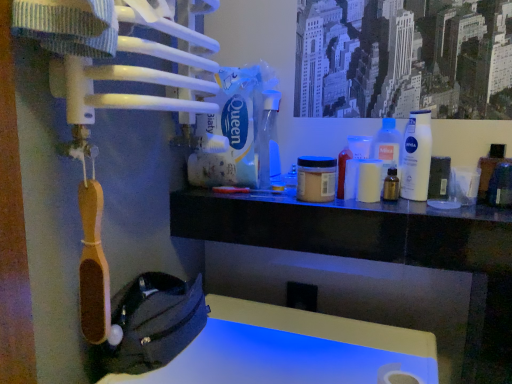
Question: From a real-world perspective, is white plastic bottle at upper right, placed as the 1th bottle when sorted from right to left, above or below translucent amber bottle at center, which is the second bottle in left-to-right order?

Choices:
 (A) below
 (B) above

Answer: (B)

Question: Based on their sizes in the image, would you say white plastic bottle at upper right, placed as the 1th bottle when sorted from right to left, is bigger or smaller than translucent amber bottle at center, which is the second bottle in left-to-right order?

Choices:
 (A) small
 (B) big

Answer: (B)

Question: Estimate the real-world distances between objects in this image. Which object is farther from the velvet black pouch at lower left?

Choices:
 (A) translucent plastic bottle at center right
 (B) white plastic bottle at upper right, which appears as the third bottle when viewed from the left
 (C) transparent plastic spray bottle at center, arranged as the third bottle when viewed from the right
 (D) translucent amber bottle at center, which appears as the 2th bottle when viewed from the right
 (E) matte brown jar at center

Answer: (B)

Question: Which object is the farthest from the velvet black pouch at lower left?

Choices:
 (A) translucent plastic bottle at center right
 (B) white plastic bottle at upper right, which appears as the third bottle when viewed from the left
 (C) translucent amber bottle at center, which is the second bottle in left-to-right order
 (D) transparent plastic spray bottle at center, arranged as the third bottle when viewed from the right
 (E) matte brown jar at center

Answer: (B)